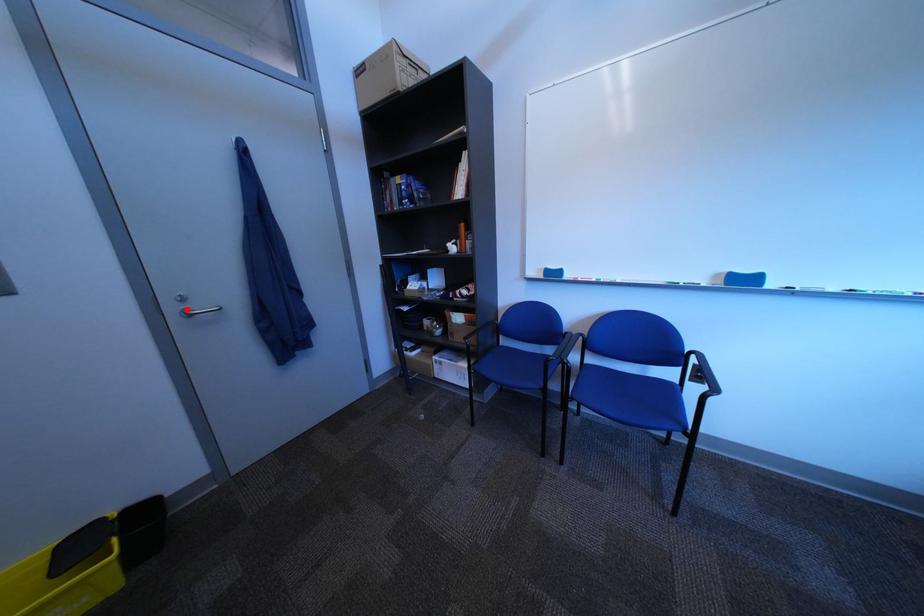
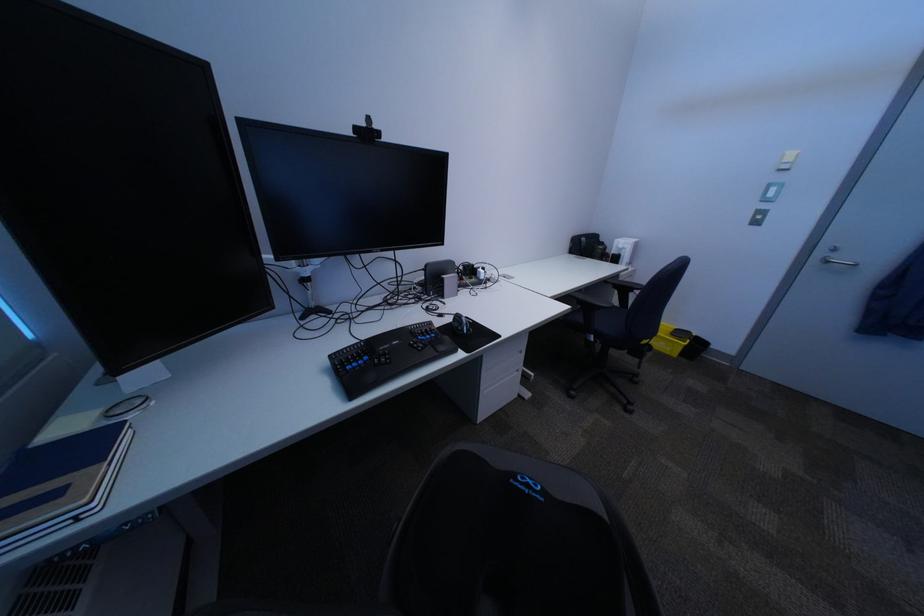
Question: I am providing you with two images of the same scene from different viewpoints. In image1, a red point is highlighted. Considering the same 3D point in image2, which of the following is correct?

Choices:
 (A) It is closer
 (B) It is farther

Answer: (B)